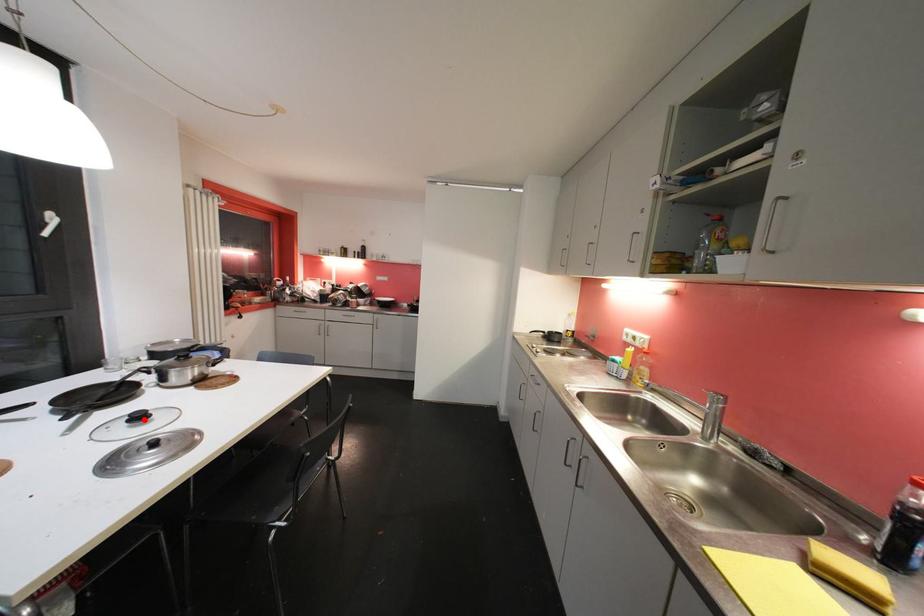
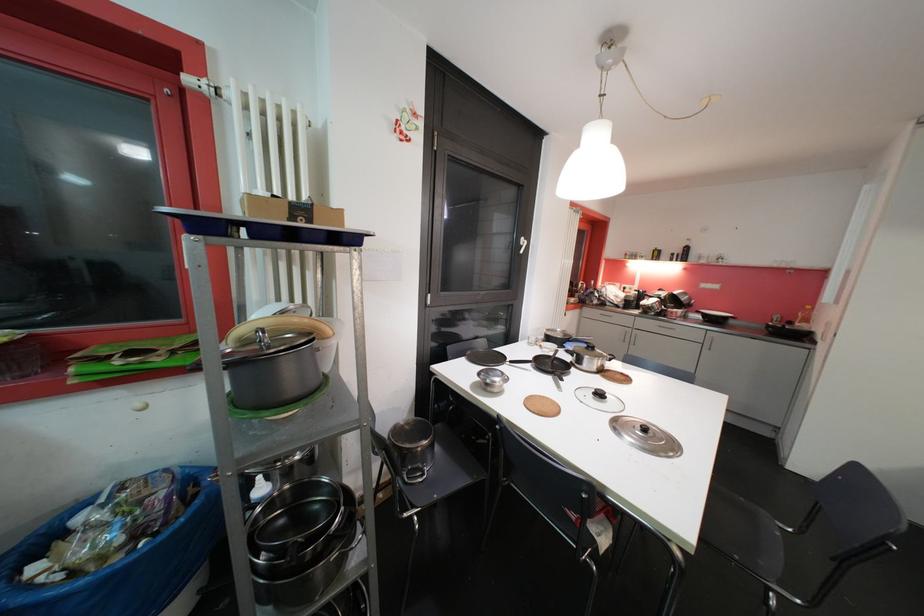
In the second image, find the point that corresponds to the highlighted location in the first image.

(604, 397)